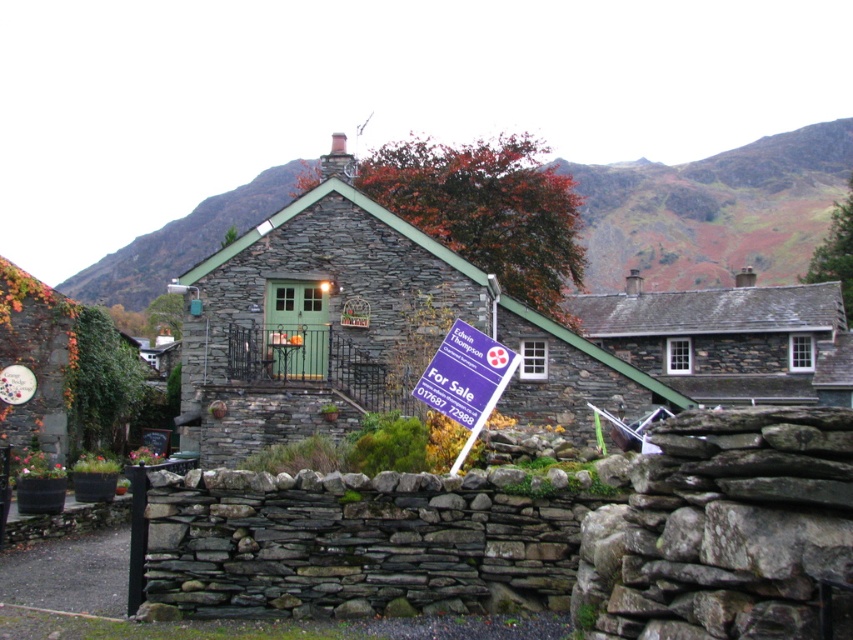
From the picture: Who is lower down, stone slate cottage at center or rustic stone cottage at center?

Positioned lower is rustic stone cottage at center.

Measure the distance from stone slate cottage at center to rustic stone cottage at center.

A distance of 23.88 meters exists between stone slate cottage at center and rustic stone cottage at center.

The width and height of the screenshot is (853, 640). I want to click on stone slate cottage at center, so click(x=363, y=330).

Which is more to the right, rustic stone cottage at center or white plastic sign at center?

From the viewer's perspective, rustic stone cottage at center appears more on the right side.

Is rustic stone cottage at center shorter than white plastic sign at center?

No.

Is point (627, 282) farther from viewer compared to point (482, 413)?

Yes, it is behind point (482, 413).

You are a GUI agent. You are given a task and a screenshot of the screen. Output one action in this format:
    pyautogui.click(x=<x>, y=<y>)
    Task: Click on the rustic stone cottage at center
    The image size is (853, 640).
    Given the screenshot: What is the action you would take?
    pyautogui.click(x=729, y=339)

Which is more to the left, stone slate cottage at center or white plastic sign at center?

white plastic sign at center is more to the left.

Looking at this image, can you confirm if stone slate cottage at center is thinner than white plastic sign at center?

No.

Between point (193, 348) and point (496, 369), which one is positioned in front?

Point (496, 369)

Locate an element on the screen. stone slate cottage at center is located at coordinates (363, 330).